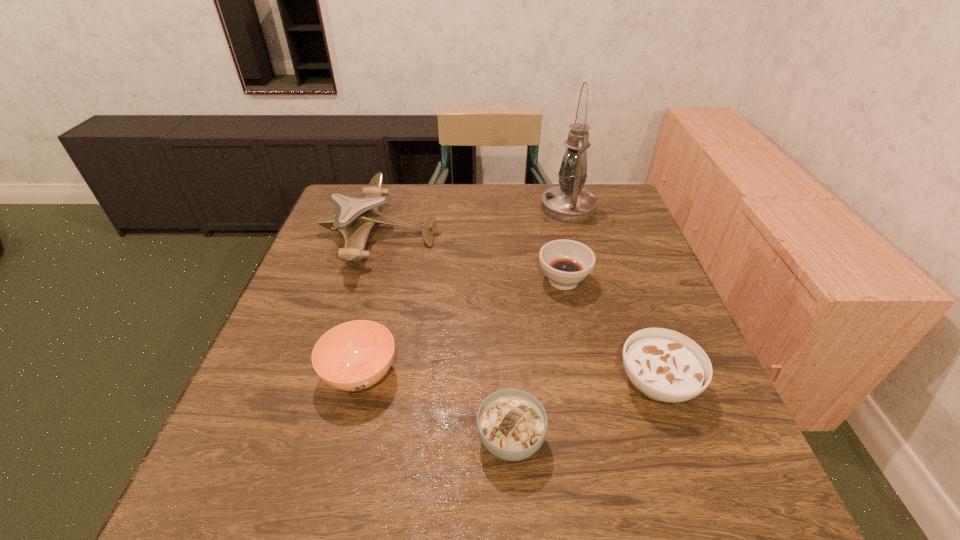
Where is `vacant space that satisfies the following two spatial constraints: 1. on the back side of the leftmost soup bowl; 2. on the front-facing side of the drone`? The image size is (960, 540). vacant space that satisfies the following two spatial constraints: 1. on the back side of the leftmost soup bowl; 2. on the front-facing side of the drone is located at coordinates (396, 233).

I want to click on free space that satisfies the following two spatial constraints: 1. on the front-facing side of the drone; 2. on the back side of the farthest soup bowl, so click(367, 280).